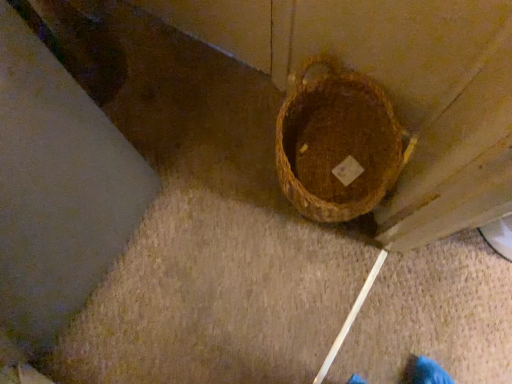
Describe the element at coordinates (338, 142) in the screenshot. This screenshot has height=384, width=512. I see `woven brown basket at center` at that location.

Measure the distance between woven brown basket at center and camera.

woven brown basket at center and camera are 35.92 inches apart from each other.

This screenshot has width=512, height=384. What are the coordinates of `woven brown basket at center` in the screenshot? It's located at (338, 142).

The height and width of the screenshot is (384, 512). I want to click on woven brown basket at center, so click(338, 142).